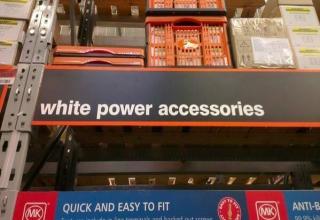
Find the location of a particular element. Image resolution: width=320 pixels, height=220 pixels. orange plastic crates is located at coordinates (202, 39), (203, 5).